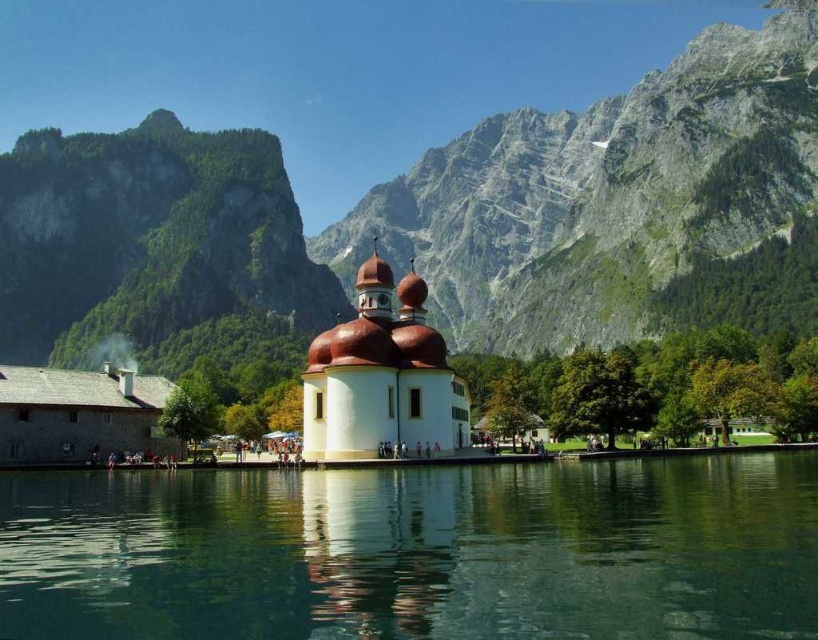
Is granite rock formation at upper center thinner than clear water at lower center?

Incorrect, granite rock formation at upper center's width is not less than clear water at lower center's.

Is granite rock formation at upper center shorter than clear water at lower center?

No.

Which is behind, point (699, 236) or point (623, 468)?

The point (699, 236) is behind.

This screenshot has width=818, height=640. Identify the location of granite rock formation at upper center. (434, 224).

Does clear water at lower center have a greater height compared to white smooth chapel at center?

Incorrect, clear water at lower center's height is not larger of white smooth chapel at center's.

Can you confirm if clear water at lower center is smaller than white smooth chapel at center?

Incorrect, clear water at lower center is not smaller in size than white smooth chapel at center.

Where is `clear water at lower center`? Image resolution: width=818 pixels, height=640 pixels. clear water at lower center is located at coordinates (416, 552).

How far apart are granite rock formation at upper center and white smooth chapel at center?

granite rock formation at upper center is 172.20 meters away from white smooth chapel at center.

Can you confirm if granite rock formation at upper center is wider than white smooth chapel at center?

Correct, the width of granite rock formation at upper center exceeds that of white smooth chapel at center.

Who is more forward, [164,144] or [309,440]?

Point [309,440]

In order to click on granite rock formation at upper center in this screenshot , I will do `click(434, 224)`.